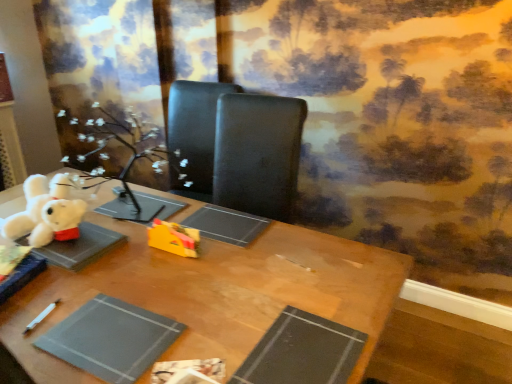
The height and width of the screenshot is (384, 512). I want to click on unoccupied space behind black matte paperback book at lower center, which is counted as the 1th paperback book, starting from the right, so click(x=285, y=281).